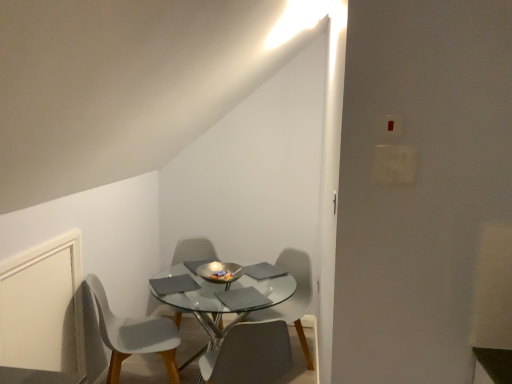
Question: Considering the positions of white plastic chair at lower left, which is the 1th chair in left-to-right order, and matte gray chair at center, the first chair viewed from the right, in the image, is white plastic chair at lower left, which is the 1th chair in left-to-right order, wider or thinner than matte gray chair at center, the first chair viewed from the right,?

Choices:
 (A) thin
 (B) wide

Answer: (B)

Question: From the image's perspective, is white plastic chair at lower left, the fourth chair when ordered from right to left, positioned above or below matte gray chair at center, which ranks as the 4th chair in left-to-right order?

Choices:
 (A) above
 (B) below

Answer: (B)

Question: Which object is positioned closest to the matte gray chair at center, positioned as the 3th chair in left-to-right order?

Choices:
 (A) white plastic chair at center, which ranks as the third chair in right-to-left order
 (B) white plastic light switch at upper right
 (C) matte gray chair at center, the first chair viewed from the right
 (D) white plastic chair at lower left, which is the 1th chair in left-to-right order
 (E) shiny metallic bowl at center

Answer: (E)

Question: Which is nearer to the white matte door at lower left?

Choices:
 (A) matte gray chair at center, the first chair viewed from the right
 (B) matte gray chair at center, which ranks as the second chair in right-to-left order
 (C) white plastic light switch at upper right
 (D) transparent glass table at center
 (E) white plastic chair at lower left, the fourth chair when ordered from right to left

Answer: (E)